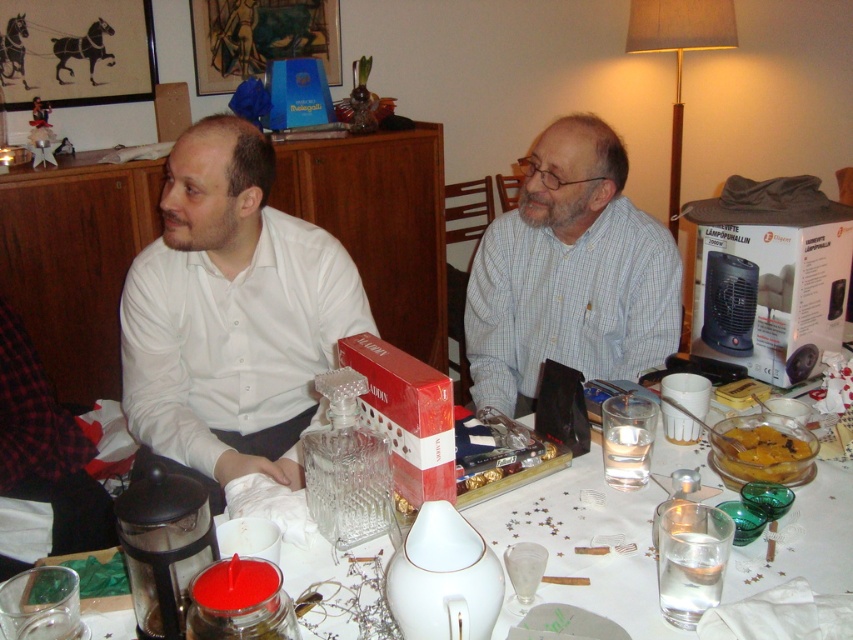
Question: From the image, what is the correct spatial relationship of white ceramic vase at center in relation to yellow matte dessert at center?

Choices:
 (A) below
 (B) above

Answer: (A)

Question: Which of the following is the closest to the observer?

Choices:
 (A) yellow matte dessert at center
 (B) white checkered shirt at center
 (C) white ceramic vase at center

Answer: (C)

Question: Among these points, which one is nearest to the camera?

Choices:
 (A) (747, 472)
 (B) (599, 376)
 (C) (642, 596)

Answer: (C)

Question: Considering the relative positions of white matte shirt at left and white checkered shirt at center in the image provided, where is white matte shirt at left located with respect to white checkered shirt at center?

Choices:
 (A) left
 (B) right

Answer: (A)

Question: Considering the real-world distances, which object is farthest from the white matte shirt at left?

Choices:
 (A) white ceramic vase at center
 (B) yellow matte dessert at center

Answer: (B)

Question: Does white ceramic vase at center come behind yellow matte dessert at center?

Choices:
 (A) no
 (B) yes

Answer: (A)